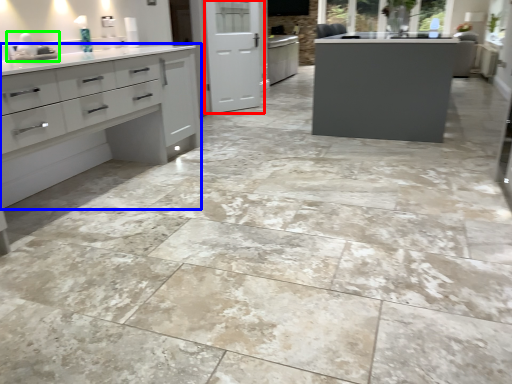
Question: Based on their relative distances, which object is nearer to screen door (highlighted by a red box)? Choose from cupboard (highlighted by a blue box) and sink (highlighted by a green box).

Choices:
 (A) cupboard
 (B) sink

Answer: (A)